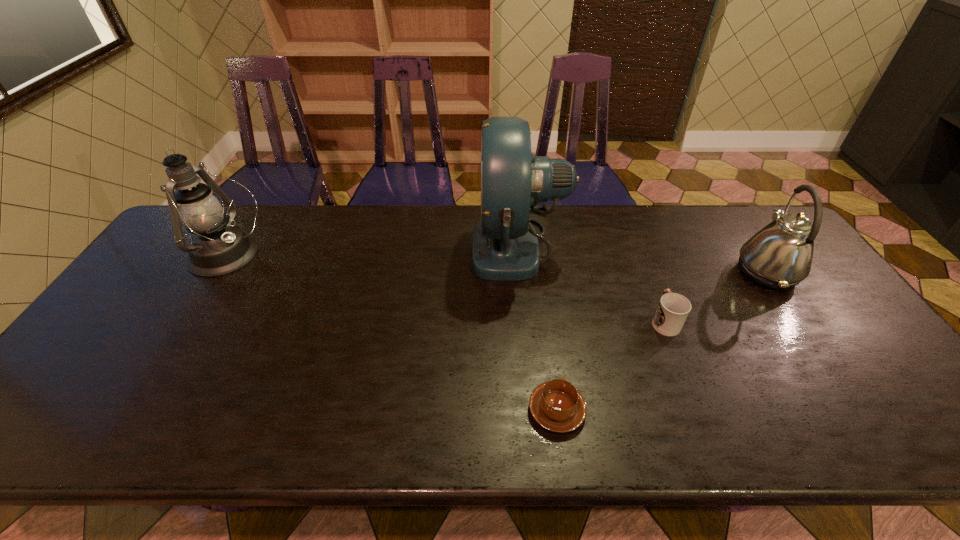
In the image, there is a desktop. In order to click on vacant space at the right edge in this screenshot , I will do click(x=837, y=375).

This screenshot has height=540, width=960. Identify the location of vacant space at the far right corner of the desktop. (749, 220).

You are a GUI agent. You are given a task and a screenshot of the screen. Output one action in this format:
    pyautogui.click(x=<x>, y=<y>)
    Task: Click on the empty space that is in between the fourth object from left to right and the nearest object
    The image size is (960, 540).
    Given the screenshot: What is the action you would take?
    pyautogui.click(x=611, y=366)

Identify the location of free space that is in between the second tallest object and the tallest object. (373, 251).

I want to click on vacant space in between the tallest object and the shortest object, so click(x=538, y=328).

Image resolution: width=960 pixels, height=540 pixels. What are the coordinates of `free space between the second tallest object and the fan` in the screenshot? It's located at (373, 251).

Image resolution: width=960 pixels, height=540 pixels. I want to click on vacant point located between the kettle and the nearest object, so click(661, 341).

This screenshot has width=960, height=540. Identify the location of free space between the nearest object and the oil lamp. (393, 333).

This screenshot has width=960, height=540. I want to click on blank region between the kettle and the cappuccino, so click(x=661, y=341).

In order to click on empty space that is in between the fan and the kettle in this screenshot , I will do `click(642, 259)`.